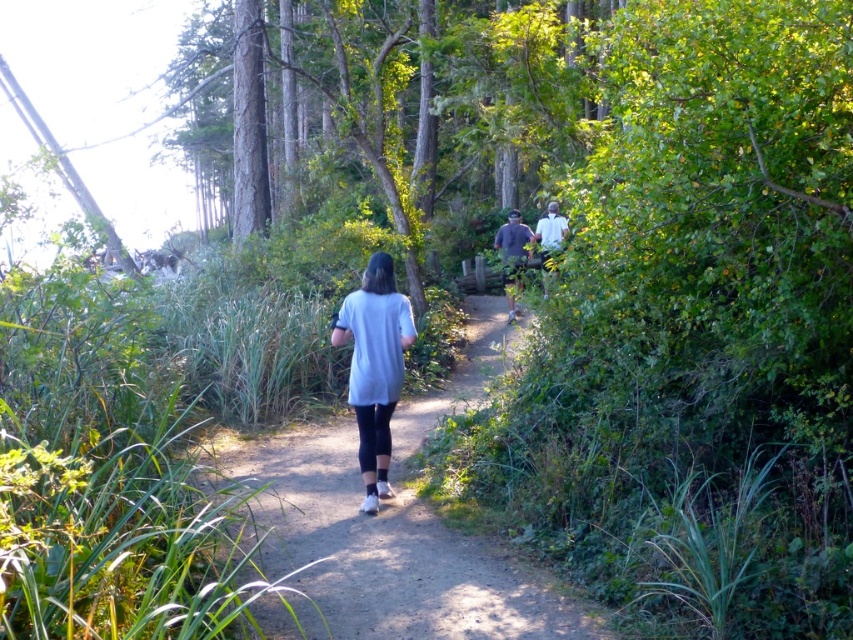
Question: Which object is positioned farthest from the dark gray shirt at center?

Choices:
 (A) gray fabric shirt at center
 (B) white matte shirt at center-right
 (C) white matte shirt at center

Answer: (C)

Question: Does dark gray shirt at center appear on the left side of white matte shirt at center-right?

Choices:
 (A) yes
 (B) no

Answer: (A)

Question: Which of these objects is positioned closest to the dark gray shirt at center?

Choices:
 (A) white matte shirt at center
 (B) white matte shirt at center-right

Answer: (B)

Question: Does gray fabric shirt at center lie behind dark gray shirt at center?

Choices:
 (A) no
 (B) yes

Answer: (A)

Question: Which point is closer to the camera?

Choices:
 (A) dark gray shirt at center
 (B) gray fabric shirt at center
 (C) white matte shirt at center
 (D) white matte shirt at center-right

Answer: (B)

Question: Is white matte shirt at center wider than dark gray shirt at center?

Choices:
 (A) yes
 (B) no

Answer: (A)